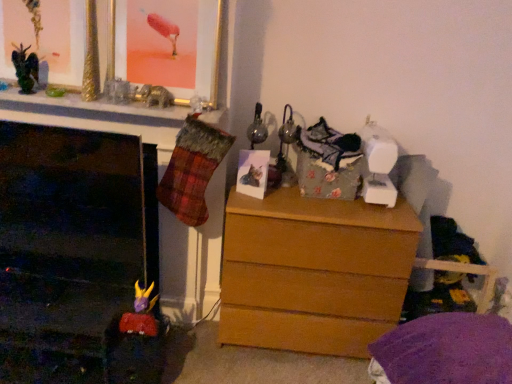
Identify the location of empty space that is to the right of matte paper photo at center, the 1th picture frame in the right-to-left sequence. (289, 193).